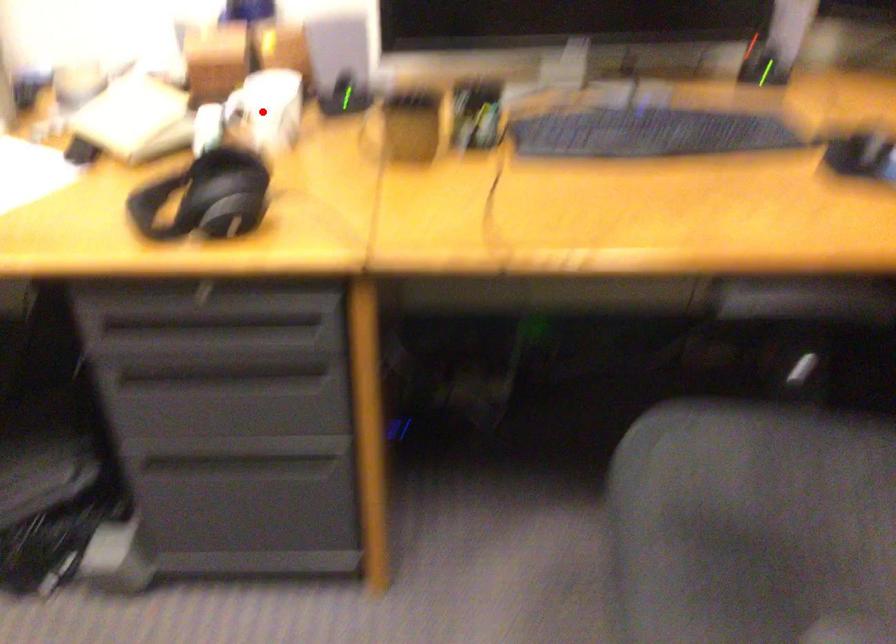
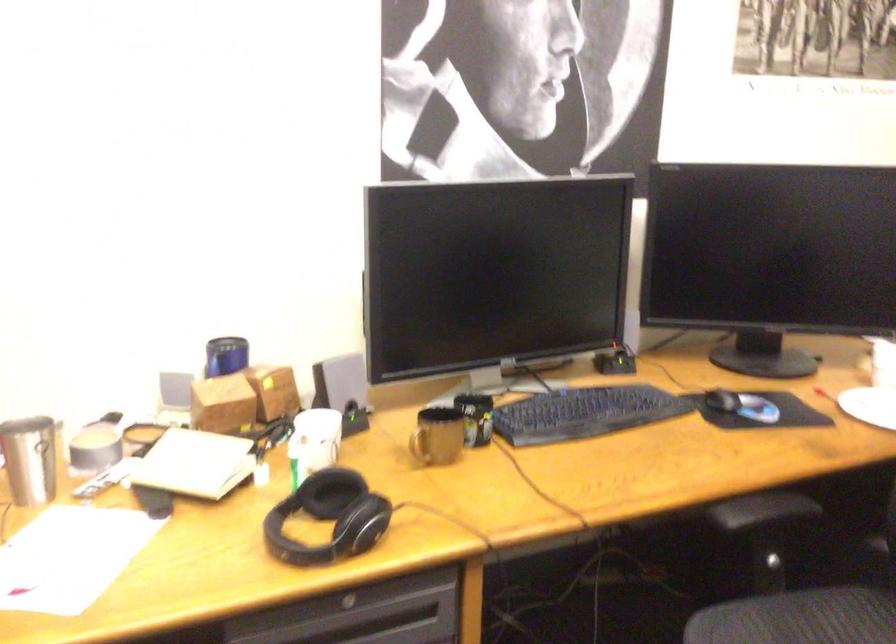
Question: I am providing you with two images of the same scene from different viewpoints. A red point is shown in image1. For the corresponding object point in image2, is it positioned nearer or farther from the camera?

Choices:
 (A) Nearer
 (B) Farther

Answer: (B)